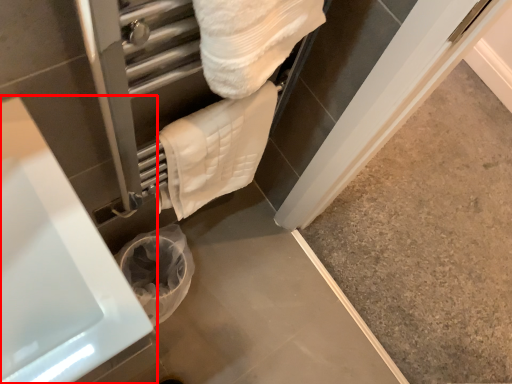
Question: From the image's perspective, what is the correct spatial positioning of bath (annotated by the red box) in reference to towel?

Choices:
 (A) above
 (B) below

Answer: (B)